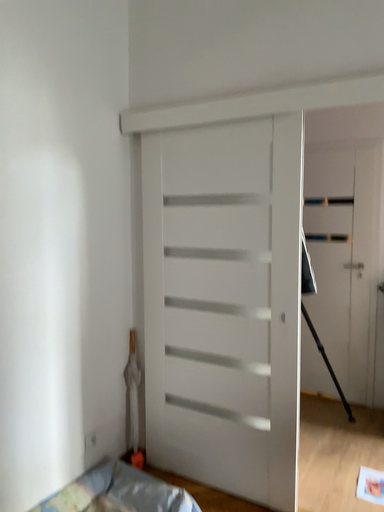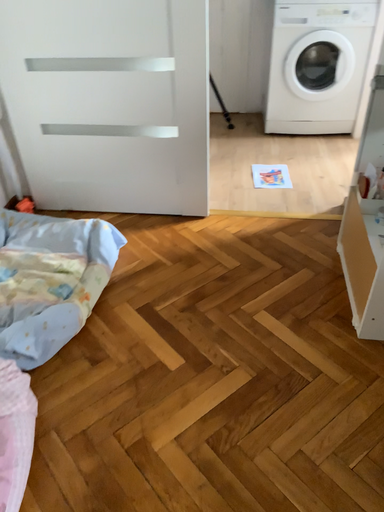
Question: How did the camera likely rotate when shooting the video?

Choices:
 (A) rotated left
 (B) rotated right

Answer: (B)